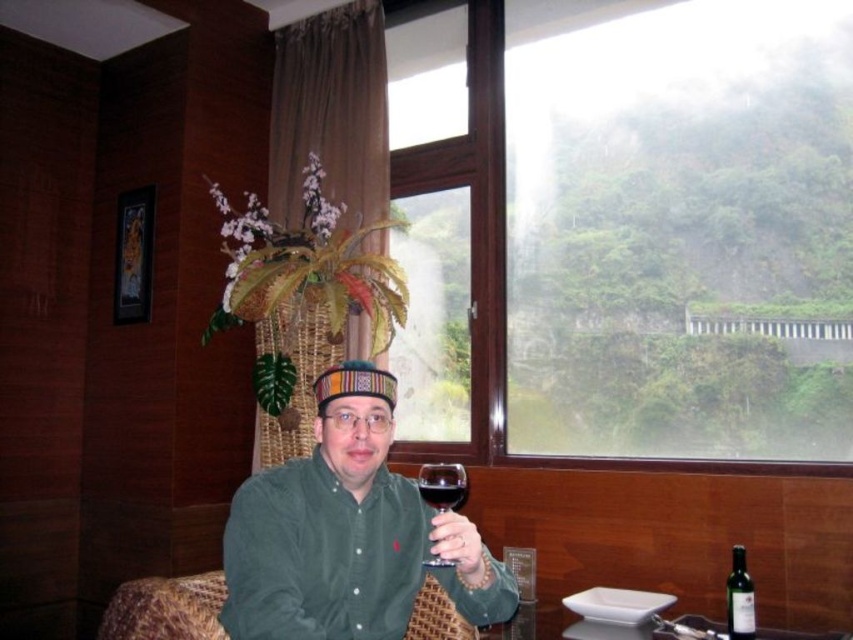
You are standing in the room and want to hand a gift to the person wearing the green corduroy shirt at center. Based on the coordinates provided, where should you approach to deliver the gift?

The green corduroy shirt at center is located at point (347, 532), so you should approach that coordinate to deliver the gift.

You are standing in the room and want to locate the green corduroy shirt at center. Based on the coordinates provided, where would you find it?

The green corduroy shirt at center is located at coordinates point (x=347, y=532).

You are a fashion designer observing the scene. You need to decide which item is larger between the green corduroy shirt at center and the green glass bottle at lower right. Which one should you choose for a design project that requires a larger object?

The green corduroy shirt at center is bigger than the green glass bottle at lower right, so you should choose the green corduroy shirt at center for the design project that requires a larger object.